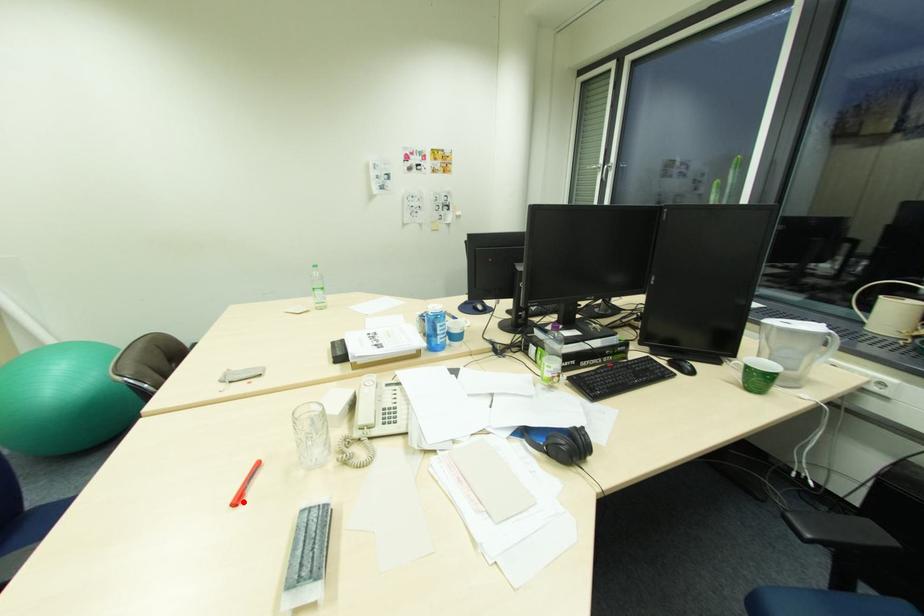
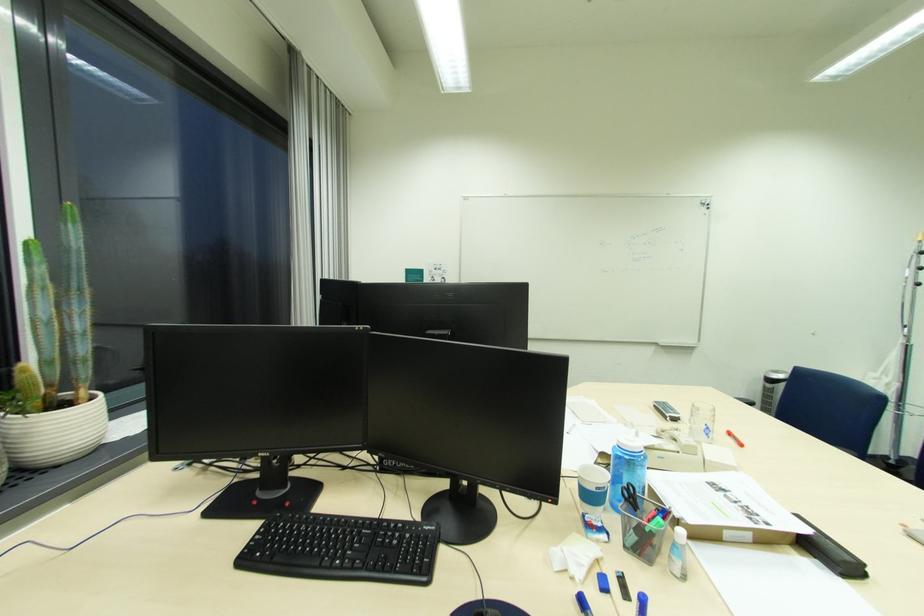
In the second image, find the point that corresponds to the highlighted location in the first image.

(736, 435)